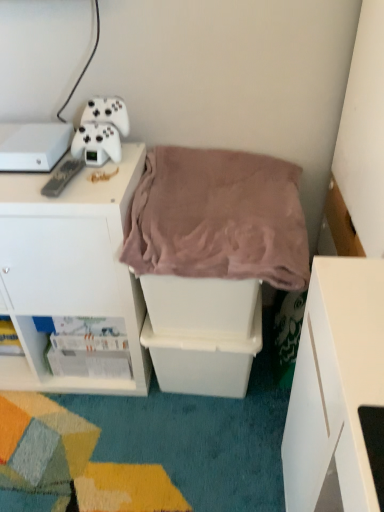
This screenshot has width=384, height=512. In order to click on free space in front of white glossy magazine at lower left, the first shelf positioned from the left in this screenshot , I will do `click(87, 420)`.